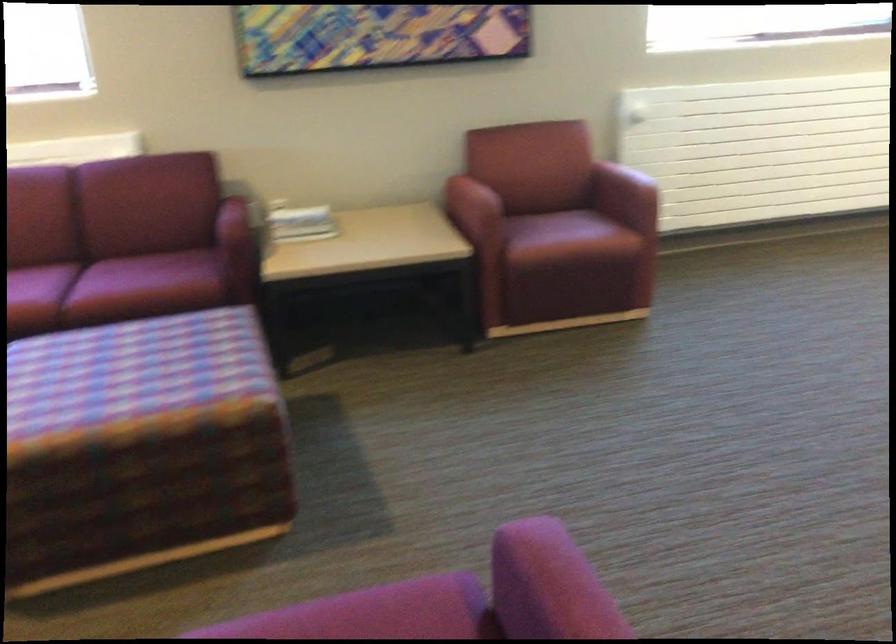
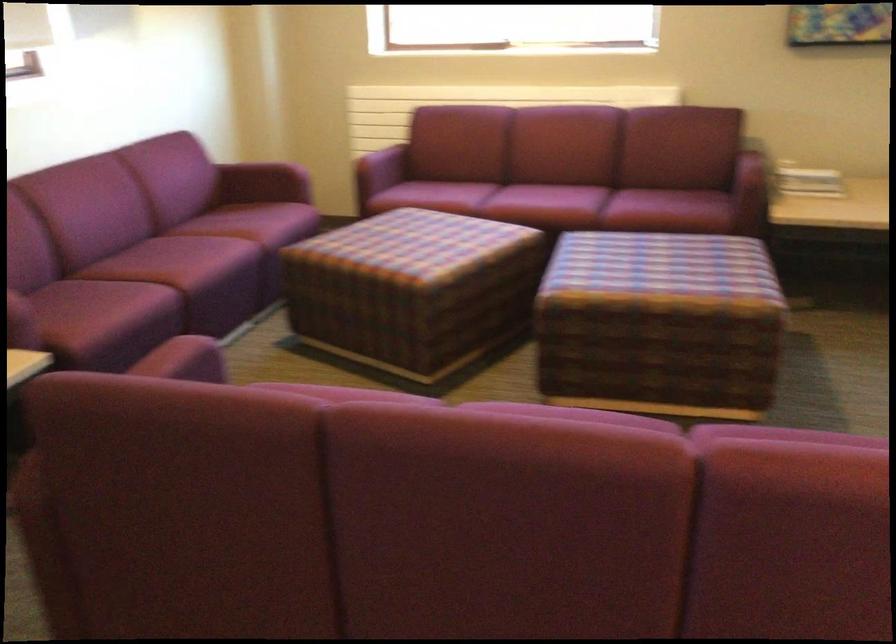
The point at (134, 464) is marked in the first image. Where is the corresponding point in the second image?

(659, 324)